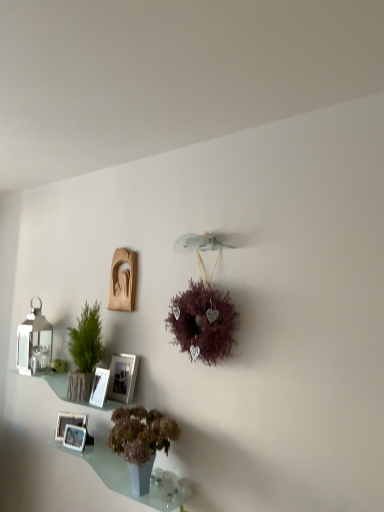
Question: Should I look upward or downward to see matte silver picture frame at center, the 2th picture frame from the top?

Choices:
 (A) down
 (B) up

Answer: (A)

Question: From a real-world perspective, is matte brown vase at lower center, which is the first houseplant in right-to-left order, under matte beige statue at upper center, marked as the first picture frame in a top-to-bottom arrangement?

Choices:
 (A) no
 (B) yes

Answer: (B)

Question: Is matte beige statue at upper center, placed as the 5th picture frame when sorted from bottom to top, at the back of matte brown vase at lower center, the 2th houseplant viewed from the top?

Choices:
 (A) yes
 (B) no

Answer: (B)

Question: Would you say matte brown vase at lower center, which is the first houseplant in front-to-back order, is a long distance from matte beige statue at upper center, placed as the 5th picture frame when sorted from bottom to top?

Choices:
 (A) yes
 (B) no

Answer: (B)

Question: From the image's perspective, is matte brown vase at lower center, arranged as the second houseplant when viewed from the left, on matte beige statue at upper center, marked as the first picture frame in a top-to-bottom arrangement?

Choices:
 (A) yes
 (B) no

Answer: (B)

Question: Could you tell me if matte brown vase at lower center, which is the first houseplant in right-to-left order, is facing matte beige statue at upper center, placed as the 5th picture frame when sorted from bottom to top?

Choices:
 (A) no
 (B) yes

Answer: (A)

Question: Does matte brown vase at lower center, the 2th houseplant viewed from the top, come behind matte beige statue at upper center, placed as the 5th picture frame when sorted from bottom to top?

Choices:
 (A) no
 (B) yes

Answer: (A)

Question: Is green textured vase at left, arranged as the second houseplant when viewed from the right, taller than white glossy picture frame at lower left, which is counted as the second picture frame, starting from the bottom?

Choices:
 (A) yes
 (B) no

Answer: (A)

Question: Would you say green textured vase at left, arranged as the second houseplant when viewed from the right, is a long distance from white glossy picture frame at lower left, the 4th picture frame when ordered from top to bottom?

Choices:
 (A) no
 (B) yes

Answer: (A)

Question: Is green textured vase at left, positioned as the first houseplant in top-to-bottom order, further to camera compared to white glossy picture frame at lower left, which is counted as the second picture frame, starting from the bottom?

Choices:
 (A) yes
 (B) no

Answer: (B)

Question: Is green textured vase at left, the 2th houseplant from the bottom, next to white glossy picture frame at lower left, which is counted as the second picture frame, starting from the bottom?

Choices:
 (A) yes
 (B) no

Answer: (B)

Question: Could white glossy picture frame at lower left, the 4th picture frame when ordered from top to bottom, be considered to be inside green textured vase at left, the 1th houseplant when ordered from back to front?

Choices:
 (A) yes
 (B) no

Answer: (B)

Question: Is green textured vase at left, arranged as the second houseplant when viewed from the right, oriented away from white glossy picture frame at lower left, the 4th picture frame when ordered from top to bottom?

Choices:
 (A) no
 (B) yes

Answer: (A)

Question: Is white glossy picture frame at lower left, arranged as the 3th picture frame when ordered from the bottom, outside translucent glass shelf at lower center, which appears as the 2th window sill when viewed from the top?

Choices:
 (A) yes
 (B) no

Answer: (A)